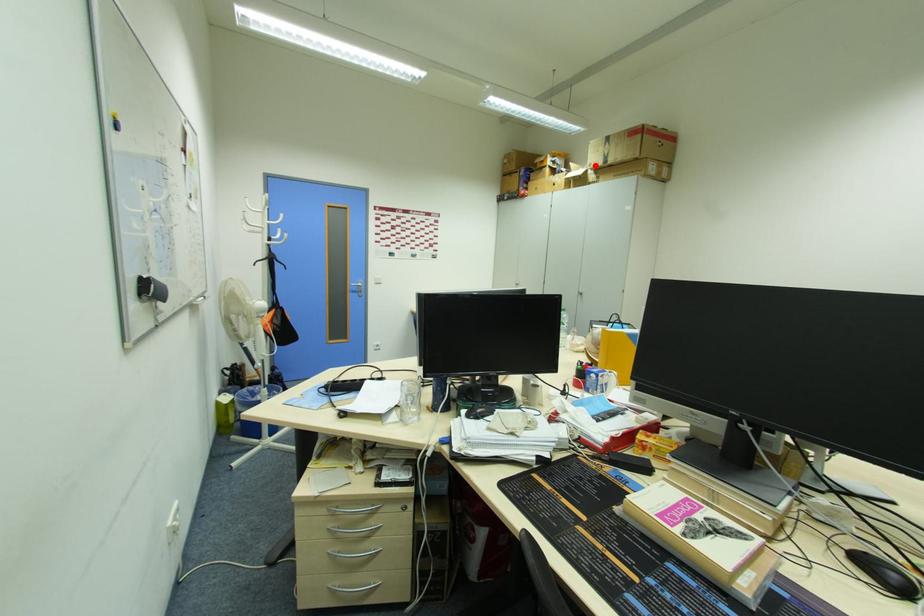
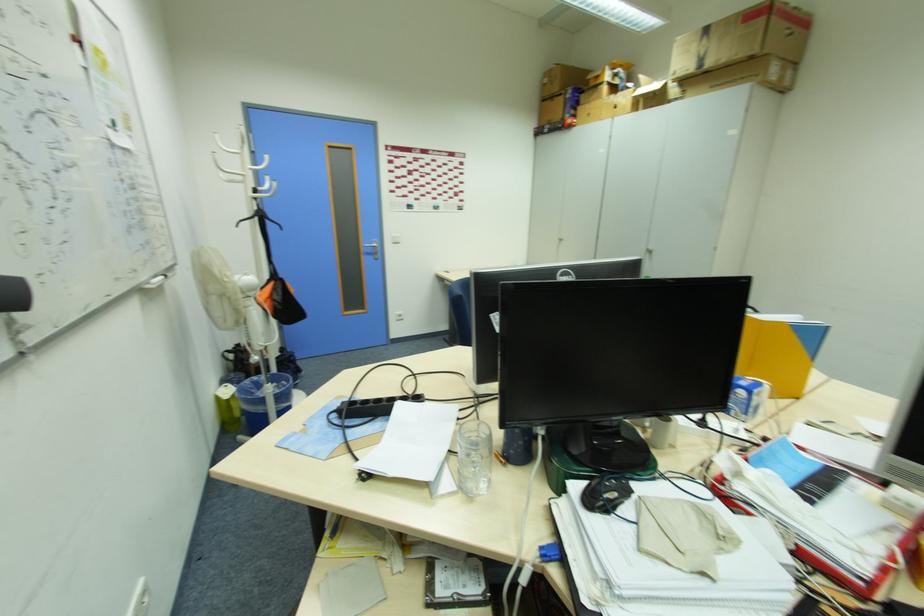
Where in the second image is the point corresponding to the highlighted location from the first image?

(685, 71)